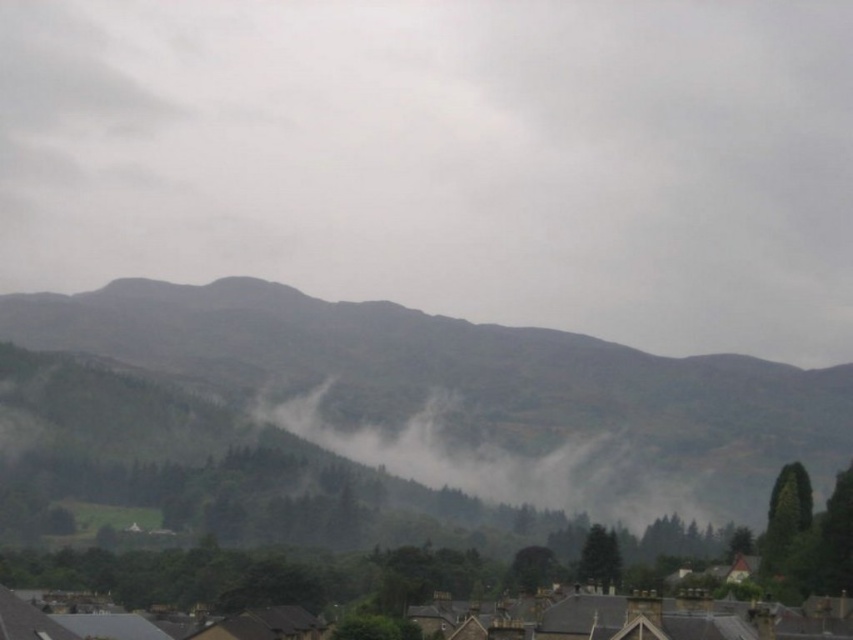
Can you confirm if green textured hillside at center is positioned above brown stone rooftops at bottom?

Yes, green textured hillside at center is above brown stone rooftops at bottom.

Does point (212, 289) come in front of point (683, 614)?

No, (212, 289) is behind (683, 614).

Between point (738, 444) and point (157, 589), which one is positioned behind?

Positioned behind is point (738, 444).

Where is `green textured hillside at center`? green textured hillside at center is located at coordinates (473, 394).

Does gray foggy cloud at upper center have a larger size compared to foggy misty valley at center?

Correct, gray foggy cloud at upper center is larger in size than foggy misty valley at center.

Is gray foggy cloud at upper center above foggy misty valley at center?

Indeed, gray foggy cloud at upper center is positioned over foggy misty valley at center.

The image size is (853, 640). Describe the element at coordinates (448, 160) in the screenshot. I see `gray foggy cloud at upper center` at that location.

Locate an element on the screen. Image resolution: width=853 pixels, height=640 pixels. gray foggy cloud at upper center is located at coordinates (448, 160).

Is point (795, 417) positioned after point (689, 508)?

Yes, point (795, 417) is behind point (689, 508).

Based on the photo, who is taller, green textured hillside at center or foggy misty valley at center?

green textured hillside at center

Which is in front, point (471, 340) or point (535, 467)?

Point (535, 467) is in front.

This screenshot has height=640, width=853. I want to click on green textured hillside at center, so click(473, 394).